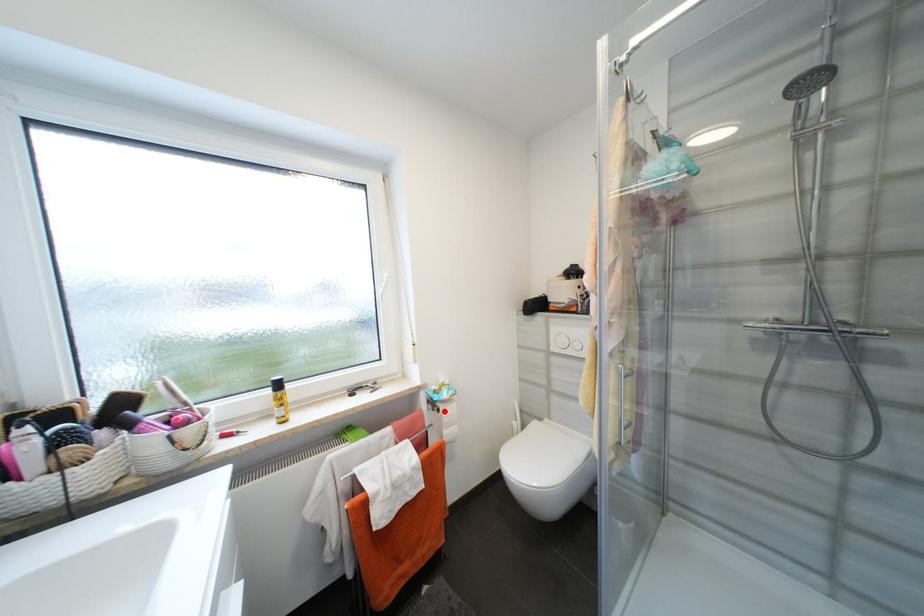
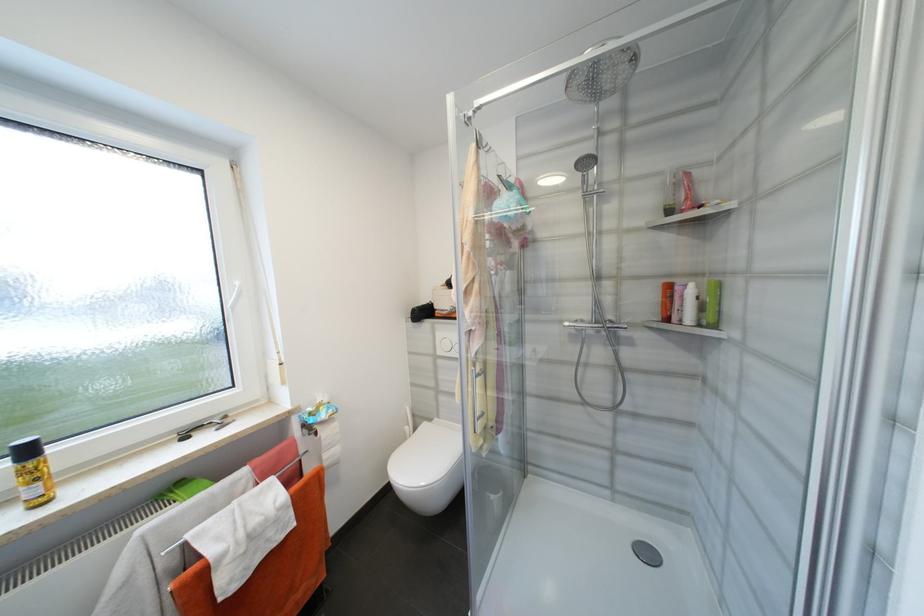
Find the pixel in the second image that matches the highlighted location in the first image.

(322, 435)